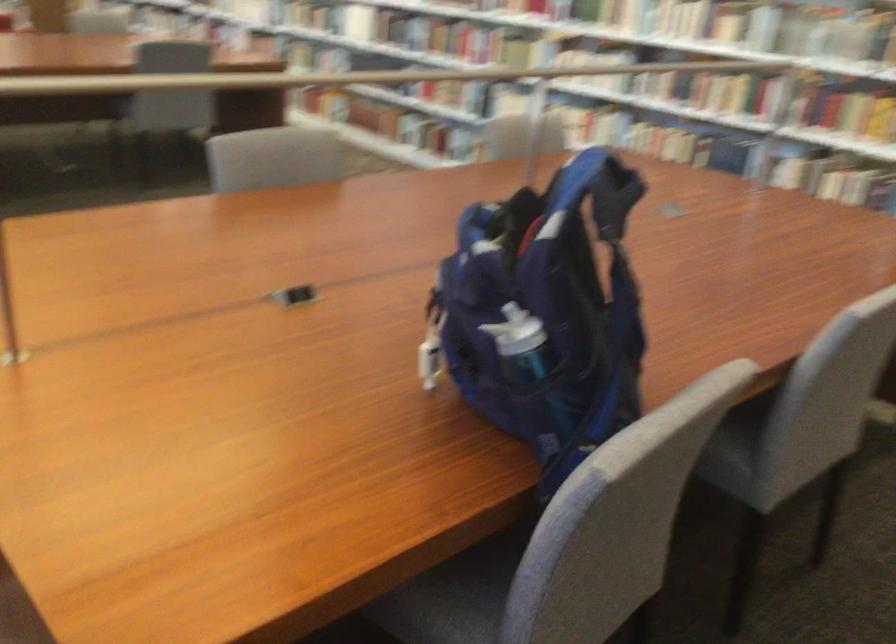
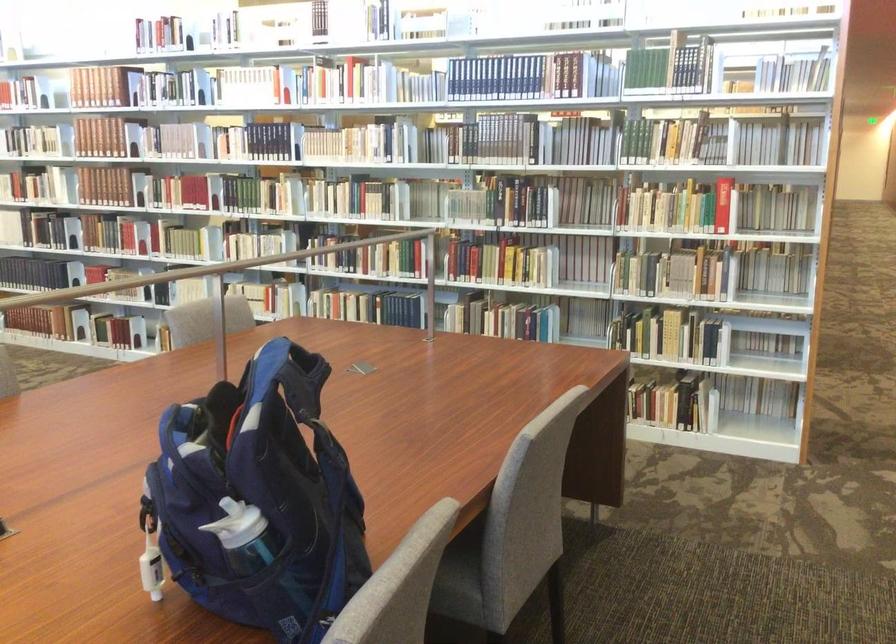
Question: The images are taken continuously from a first-person perspective. In which direction are you moving?

Choices:
 (A) Left
 (B) Right
 (C) Forward
 (D) Backward

Answer: (D)